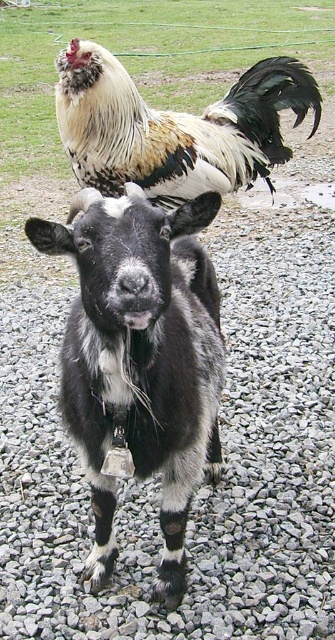
Does black and white fur goat at center have a lesser width compared to golden brown feathers at upper center?

Indeed, black and white fur goat at center has a lesser width compared to golden brown feathers at upper center.

The image size is (335, 640). Find the location of `black and white fur goat at center`. black and white fur goat at center is located at coordinates (141, 358).

Where is `black and white fur goat at center`? The height and width of the screenshot is (640, 335). black and white fur goat at center is located at coordinates (141, 358).